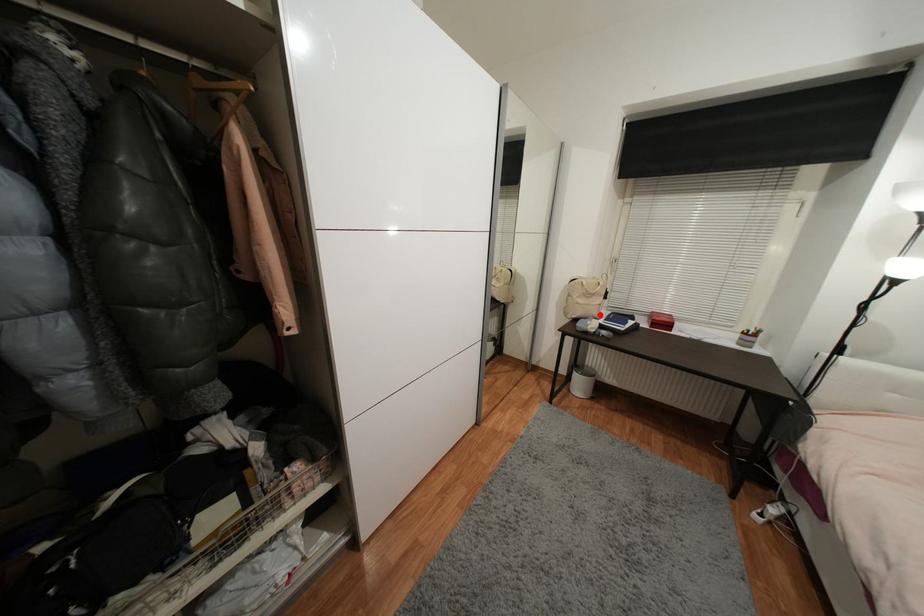
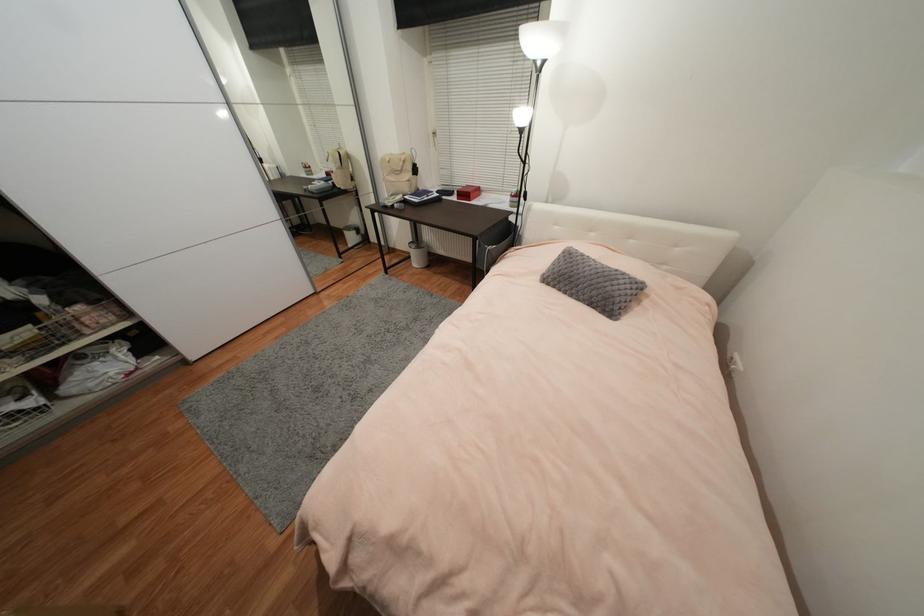
Question: I am providing you with two images of the same scene from different viewpoints. A red point is marked on the first image. Can you still see the location of the red point in image 2?

Choices:
 (A) Yes
 (B) No

Answer: (A)